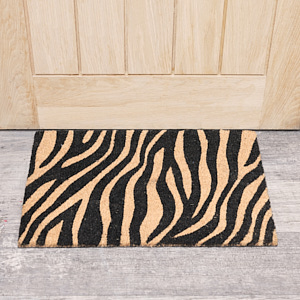
The height and width of the screenshot is (300, 300). What are the coordinates of `left door crease` in the screenshot? It's located at (31, 60).